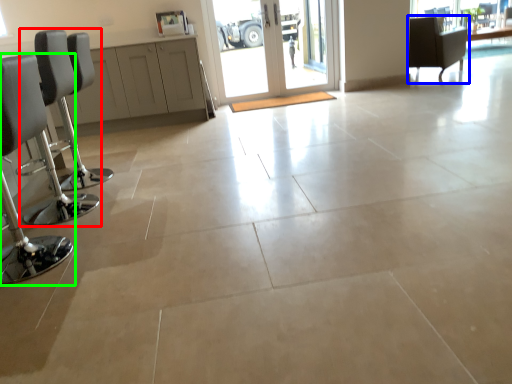
Question: Which object is the closest to the chair (highlighted by a red box)? Choose among these: chair (highlighted by a blue box) or chair (highlighted by a green box).

Choices:
 (A) chair
 (B) chair

Answer: (B)